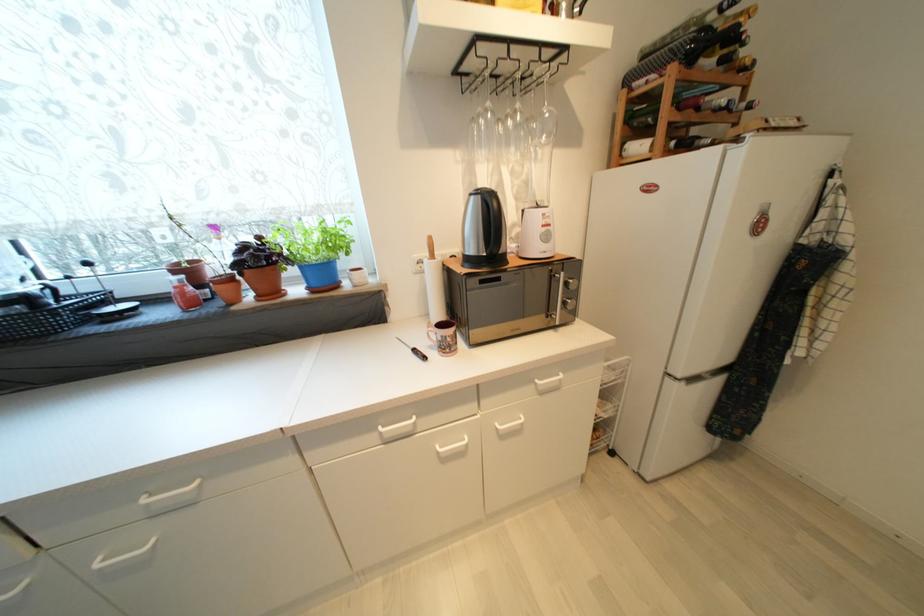
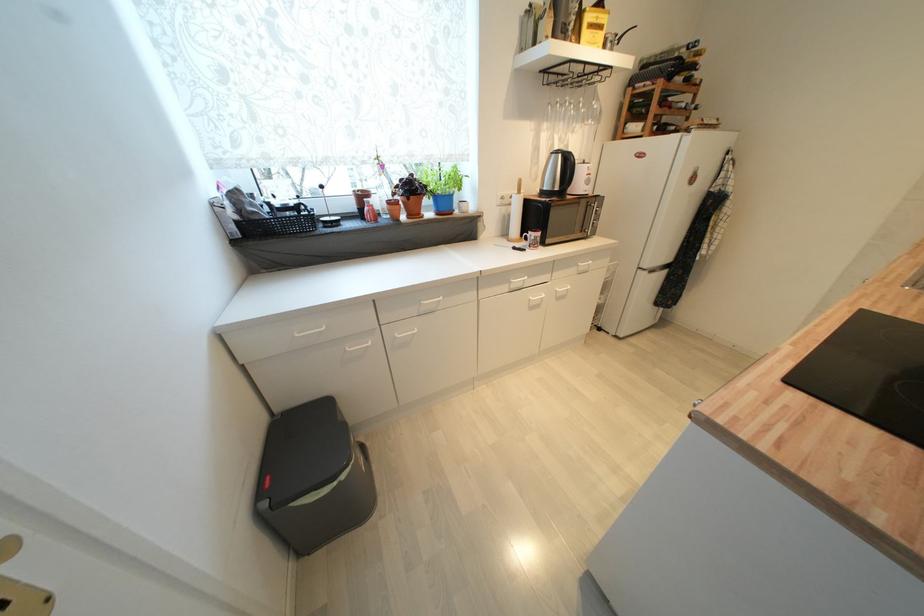
In the second image, find the point that corresponds to [533,121] in the first image.

(589, 108)